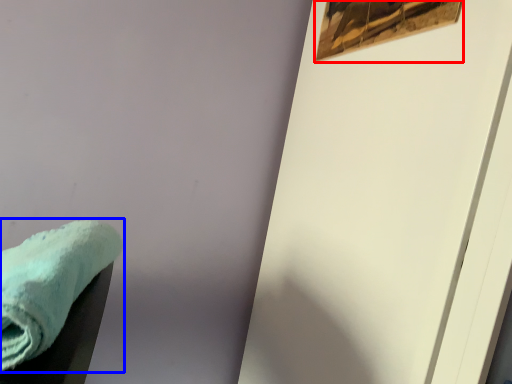
Question: Which of the following is the farthest to the observer, picture frame (highlighted by a red box) or towel (highlighted by a blue box)?

Choices:
 (A) picture frame
 (B) towel

Answer: (A)